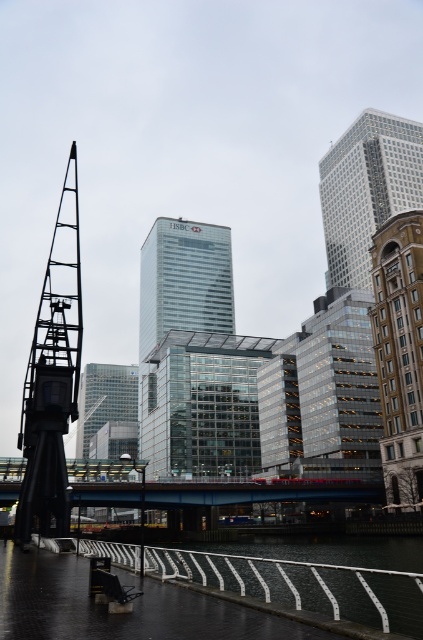
Who is lower down, black metal crane at left or glassy skyscraper at center?

glassy skyscraper at center

Does black metal crane at left appear under glassy skyscraper at center?

No, black metal crane at left is not below glassy skyscraper at center.

At what (x,y) coordinates should I click in order to perform the action: click on black metal crane at left. Please return your answer as a coordinate pair (x, y). This screenshot has width=423, height=640. Looking at the image, I should click on [x=52, y=378].

Is point (354, 273) positioned after point (82, 417)?

No, it is in front of (82, 417).

Is glassy skyscraper at upper right to the right of clear glass skyscraper at center from the viewer's perspective?

Indeed, glassy skyscraper at upper right is positioned on the right side of clear glass skyscraper at center.

Is point (332, 284) positioned after point (126, 385)?

No, it is not.

This screenshot has height=640, width=423. Find the location of `glassy skyscraper at upper right`. glassy skyscraper at upper right is located at coordinates (367, 189).

Is black metal crane at left bigger than clear glass skyscraper at center?

Correct, black metal crane at left is larger in size than clear glass skyscraper at center.

Looking at this image, can you confirm if black metal crane at left is positioned to the left of clear glass skyscraper at center?

Incorrect, black metal crane at left is not on the left side of clear glass skyscraper at center.

Describe the element at coordinates (52, 378) in the screenshot. I see `black metal crane at left` at that location.

Locate an element on the screen. The width and height of the screenshot is (423, 640). black metal crane at left is located at coordinates (52, 378).